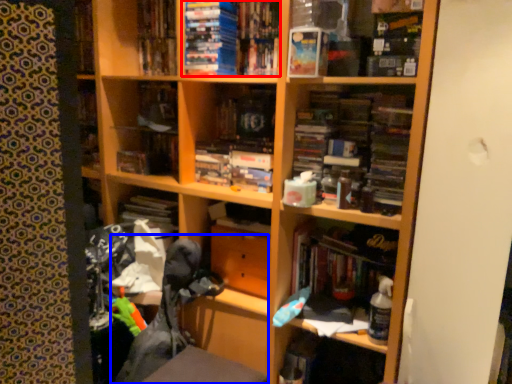
Question: Which object appears closest to the camera in this image, book (highlighted by a red box) or swivel chair (highlighted by a blue box)?

Choices:
 (A) book
 (B) swivel chair

Answer: (B)